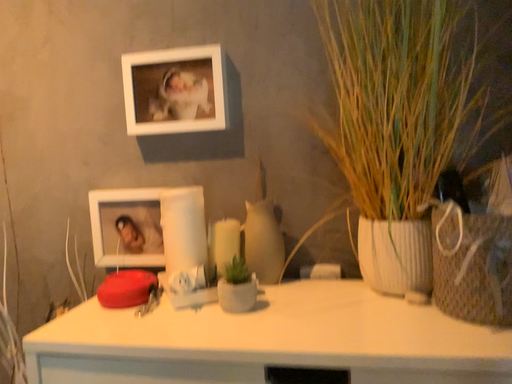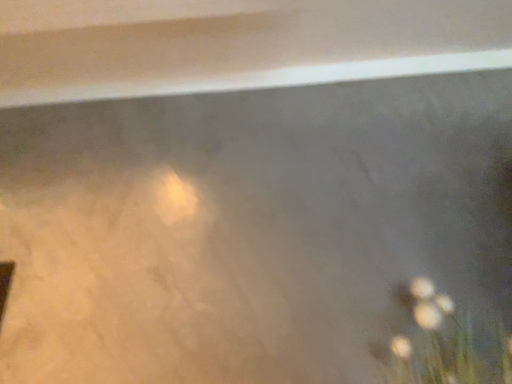
Question: Which way did the camera rotate in the video?

Choices:
 (A) rotated downward
 (B) rotated upward

Answer: (B)